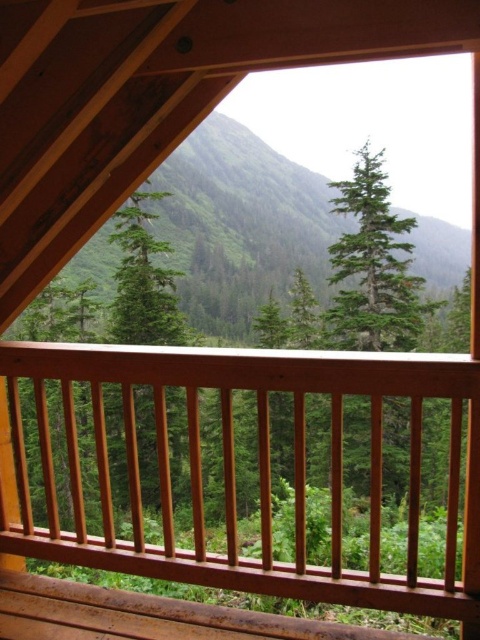
Looking at this image, who is positioned more to the right, smooth wood railing at center or green matte tree at center?

smooth wood railing at center is more to the right.

Is smooth wood railing at center taller than green matte tree at center?

Yes, smooth wood railing at center is taller than green matte tree at center.

Which is in front, point (448, 566) or point (166, 294)?

Positioned in front is point (448, 566).

This screenshot has width=480, height=640. Find the location of `smooth wood railing at center`. smooth wood railing at center is located at coordinates (235, 470).

Does green textured mountain at upper center appear on the left side of green matte tree at center?

Incorrect, green textured mountain at upper center is not on the left side of green matte tree at center.

Can you confirm if green textured mountain at upper center is positioned below green matte tree at center?

No, green textured mountain at upper center is not below green matte tree at center.

This screenshot has width=480, height=640. Find the location of `green textured mountain at upper center`. green textured mountain at upper center is located at coordinates (241, 225).

Who is positioned more to the right, smooth wood railing at center or green textured mountain at upper center?

Positioned to the right is green textured mountain at upper center.

Does smooth wood railing at center have a greater height compared to green textured mountain at upper center?

No.

Does point (219, 573) come closer to viewer compared to point (181, 156)?

That is True.

Locate an element on the screen. smooth wood railing at center is located at coordinates (235, 470).